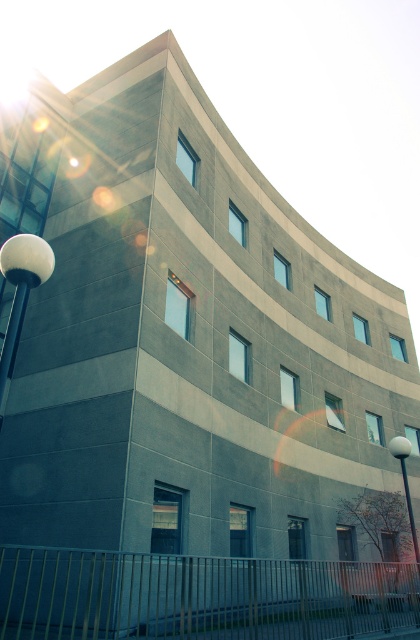
Is white glossy sphere at upper left smaller than white glossy lamp post at lower right?

Actually, white glossy sphere at upper left might be larger than white glossy lamp post at lower right.

Which is behind, point (18, 275) or point (406, 451)?

The point (406, 451) is behind.

Identify the location of white glossy sphere at upper left. This screenshot has height=640, width=420. (21, 288).